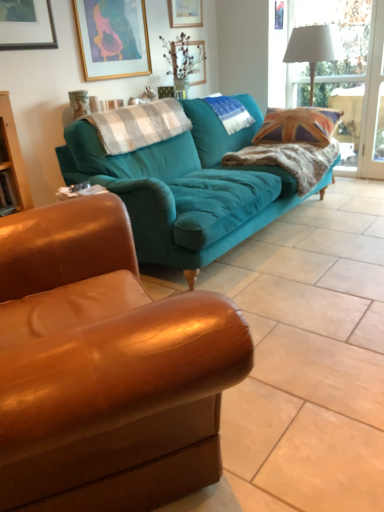
Question: Can you confirm if white fabric lampshade at upper right is shorter than teal fabric pillow at center, the 1th pillow when ordered from back to front?

Choices:
 (A) no
 (B) yes

Answer: (A)

Question: From a real-world perspective, is white fabric lampshade at upper right under teal fabric pillow at center, the 1th pillow when ordered from back to front?

Choices:
 (A) yes
 (B) no

Answer: (B)

Question: Does white fabric lampshade at upper right come behind teal fabric pillow at center, which is the second pillow from left to right?

Choices:
 (A) no
 (B) yes

Answer: (A)

Question: Is white fabric lampshade at upper right in contact with teal fabric pillow at center, the first pillow when ordered from right to left?

Choices:
 (A) yes
 (B) no

Answer: (B)

Question: Can you confirm if white fabric lampshade at upper right is wider than teal fabric pillow at center, the 1th pillow when ordered from back to front?

Choices:
 (A) no
 (B) yes

Answer: (B)

Question: Is white fabric lampshade at upper right positioned with its back to teal fabric pillow at center, the first pillow when ordered from right to left?

Choices:
 (A) yes
 (B) no

Answer: (B)

Question: From a real-world perspective, is teal fabric couch at center, marked as the second studio couch in a front-to-back arrangement, located higher than teal fabric couch at center, arranged as the 2th studio couch when viewed from the back?

Choices:
 (A) yes
 (B) no

Answer: (B)

Question: Does teal fabric couch at center, the 1th studio couch positioned from the back, contain teal fabric couch at center, the first studio couch when ordered from front to back?

Choices:
 (A) yes
 (B) no

Answer: (B)

Question: Are teal fabric couch at center, the 1th studio couch positioned from the back, and teal fabric couch at center, arranged as the 2th studio couch when viewed from the back, making contact?

Choices:
 (A) yes
 (B) no

Answer: (B)

Question: From a real-world perspective, is teal fabric couch at center, the 1th studio couch positioned from the back, beneath teal fabric couch at center, arranged as the 2th studio couch when viewed from the back?

Choices:
 (A) yes
 (B) no

Answer: (A)

Question: Is teal fabric couch at center, the 1th studio couch positioned from the back, not near teal fabric couch at center, arranged as the 2th studio couch when viewed from the back?

Choices:
 (A) no
 (B) yes

Answer: (B)

Question: Can you confirm if teal fabric couch at center, marked as the second studio couch in a front-to-back arrangement, is taller than teal fabric couch at center, arranged as the 2th studio couch when viewed from the back?

Choices:
 (A) no
 (B) yes

Answer: (A)

Question: From a real-world perspective, is teal fabric pillow at center, which is the second pillow from left to right, over clear glass window at upper right?

Choices:
 (A) no
 (B) yes

Answer: (A)